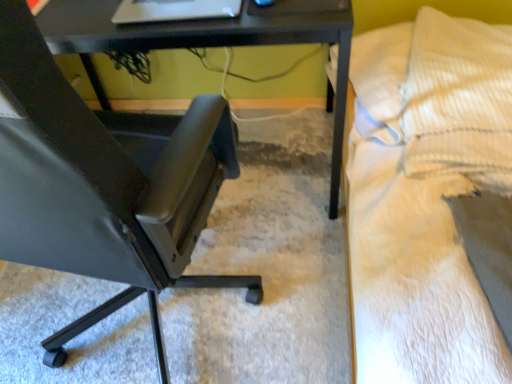
What is the approximate width of matte black chair at left?

matte black chair at left is 66.96 centimeters in width.

Locate an element on the screen. yellow corduroy pillow at upper right is located at coordinates (459, 101).

Find the location of `white textured bed at right`. white textured bed at right is located at coordinates (425, 196).

Where is `black plastic table at center`? black plastic table at center is located at coordinates (206, 42).

At what (x,y) coordinates should I click in order to perform the action: click on matte black chair at left. Please return your answer as a coordinate pair (x, y). This screenshot has width=512, height=384. Looking at the image, I should click on (104, 183).

Is matte black chair at left looking in the opposite direction of black plastic table at center?

No, black plastic table at center is not at the back of matte black chair at left.

From the image's perspective, which one is positioned lower, matte black chair at left or black plastic table at center?

matte black chair at left, from the image's perspective.

Is matte black chair at left thinner than black plastic table at center?

Yes, matte black chair at left is thinner than black plastic table at center.

From a real-world perspective, which object stands above the other?

In real-world perspective, matte black chair at left is above.

Could you tell me if yellow corduroy pillow at upper right is facing black plastic table at center?

No, yellow corduroy pillow at upper right is not oriented towards black plastic table at center.

From a real-world perspective, is yellow corduroy pillow at upper right positioned above or below black plastic table at center?

yellow corduroy pillow at upper right is situated higher than black plastic table at center in the real world.

From the image's perspective, is yellow corduroy pillow at upper right on top of black plastic table at center?

Incorrect, from the image's perspective, yellow corduroy pillow at upper right is lower than black plastic table at center.

From a real-world perspective, is black plastic table at center over white textured bed at right?

Yes.

Looking at this image, in terms of width, does black plastic table at center look wider or thinner when compared to white textured bed at right?

Clearly, black plastic table at center has less width compared to white textured bed at right.

From the image's perspective, is black plastic table at center on top of white textured bed at right?

Yes.

Is black plastic table at center positioned beyond the bounds of white textured bed at right?

Absolutely, black plastic table at center is external to white textured bed at right.

Are white textured bed at right and matte black chair at left making contact?

white textured bed at right and matte black chair at left are not in contact.

In the scene shown: Could you tell me if white textured bed at right is turned towards matte black chair at left?

Yes, white textured bed at right is aimed at matte black chair at left.

Considering the sizes of objects white textured bed at right and matte black chair at left in the image provided, who is bigger, white textured bed at right or matte black chair at left?

white textured bed at right is bigger.

From their relative heights in the image, would you say white textured bed at right is taller or shorter than yellow corduroy pillow at upper right?

white textured bed at right is taller than yellow corduroy pillow at upper right.

From a real-world perspective, relative to yellow corduroy pillow at upper right, is white textured bed at right vertically above or below?

Clearly, from a real-world perspective, white textured bed at right is below yellow corduroy pillow at upper right.

Based on the photo, looking at their sizes, would you say white textured bed at right is wider or thinner than yellow corduroy pillow at upper right?

Clearly, white textured bed at right has more width compared to yellow corduroy pillow at upper right.

From a real-world perspective, is yellow corduroy pillow at upper right positioned under matte black chair at left based on gravity?

Yes, from a real-world perspective, yellow corduroy pillow at upper right is below matte black chair at left.

Is yellow corduroy pillow at upper right thinner than matte black chair at left?

Yes.

What's the angular difference between yellow corduroy pillow at upper right and matte black chair at left's facing directions?

They differ by 101 degrees in their facing directions.

Identify the location of pillow above the matte black chair at left (from the image's perspective). The width and height of the screenshot is (512, 384). (459, 101).

Which is nearer, (490, 324) or (216, 30)?

The point (490, 324) is more forward.

Can you confirm if white textured bed at right is shorter than black plastic table at center?

Yes.

From the image's perspective, would you say white textured bed at right is positioned over black plastic table at center?

Actually, white textured bed at right appears below black plastic table at center in the image.

Visually, is white textured bed at right positioned to the left or to the right of black plastic table at center?

white textured bed at right is positioned on black plastic table at center's right side.

At what (x,y) coordinates should I click in order to perform the action: click on chair in front of the black plastic table at center. Please return your answer as a coordinate pair (x, y). This screenshot has height=384, width=512. Looking at the image, I should click on (104, 183).

I want to click on pillow below the black plastic table at center (from the image's perspective), so coord(459,101).

Considering their positions, is white textured bed at right positioned further to yellow corduroy pillow at upper right than matte black chair at left?

matte black chair at left.

Estimate the real-world distances between objects in this image. Which object is further from matte black chair at left, white textured bed at right or yellow corduroy pillow at upper right?

yellow corduroy pillow at upper right is positioned further to the anchor matte black chair at left.

Which object lies further to the anchor point white textured bed at right, matte black chair at left or black plastic table at center?

matte black chair at left is positioned further to the anchor white textured bed at right.

Which object lies further to the anchor point matte black chair at left, yellow corduroy pillow at upper right or black plastic table at center?

yellow corduroy pillow at upper right is further to matte black chair at left.

Based on the photo, estimate the real-world distances between objects in this image. Which object is closer to black plastic table at center, matte black chair at left or white textured bed at right?

white textured bed at right is positioned closer to the anchor black plastic table at center.

Which object lies further to the anchor point white textured bed at right, black plastic table at center or yellow corduroy pillow at upper right?

black plastic table at center lies further to white textured bed at right than the other object.

When comparing their distances from yellow corduroy pillow at upper right, does white textured bed at right or black plastic table at center seem further?

black plastic table at center is positioned further to the anchor yellow corduroy pillow at upper right.

Which object lies further to the anchor point white textured bed at right, matte black chair at left or yellow corduroy pillow at upper right?

matte black chair at left.

The width and height of the screenshot is (512, 384). What are the coordinates of `bed between black plastic table at center and yellow corduroy pillow at upper right in the horizontal direction` in the screenshot? It's located at (425, 196).

Locate an element on the screen. This screenshot has width=512, height=384. bed between matte black chair at left and yellow corduroy pillow at upper right in the horizontal direction is located at coordinates (425, 196).

Where is `table between matte black chair at left and white textured bed at right`? The height and width of the screenshot is (384, 512). table between matte black chair at left and white textured bed at right is located at coordinates (206, 42).

You are a GUI agent. You are given a task and a screenshot of the screen. Output one action in this format:
    pyautogui.click(x=<x>, y=<y>)
    Task: Click on the table between matte black chair at left and yellow corduroy pillow at upper right from left to right
    
    Given the screenshot: What is the action you would take?
    206,42